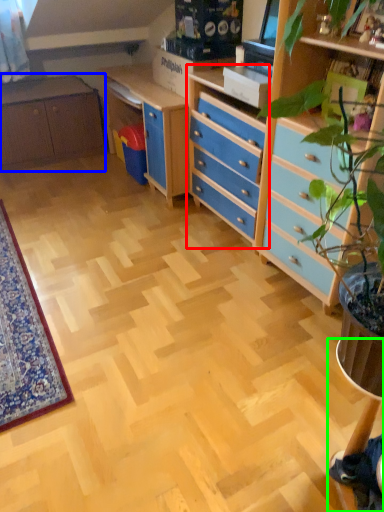
Question: Based on their relative distances, which object is nearer to chest of drawers (highlighted by a red box)? Choose from cabinetry (highlighted by a blue box) and computer desk (highlighted by a green box).

Choices:
 (A) cabinetry
 (B) computer desk

Answer: (A)